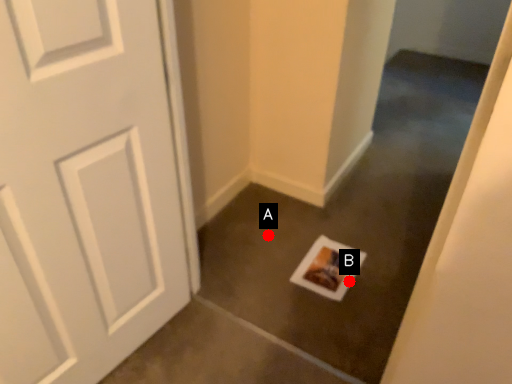
Question: Two points are circled on the image, labeled by A and B beside each circle. Which point is farther from the camera taking this photo?

Choices:
 (A) A is further
 (B) B is further

Answer: (A)